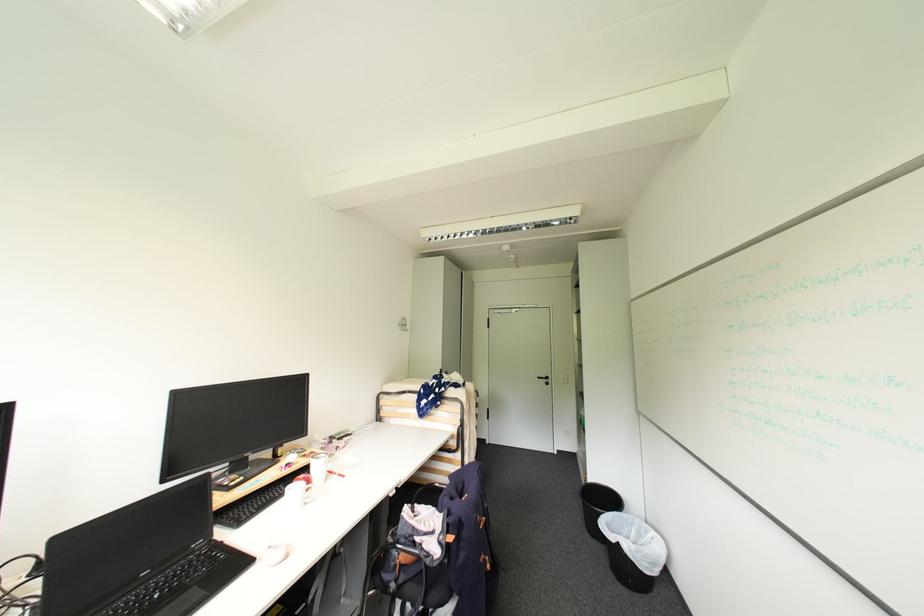
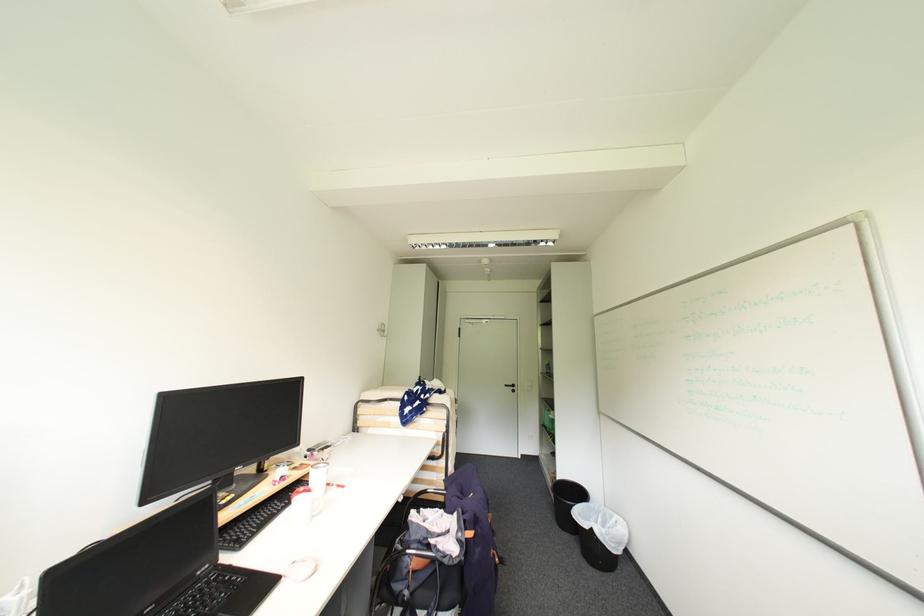
Locate, in the second image, the point that corresponds to (544,379) in the first image.

(513, 387)